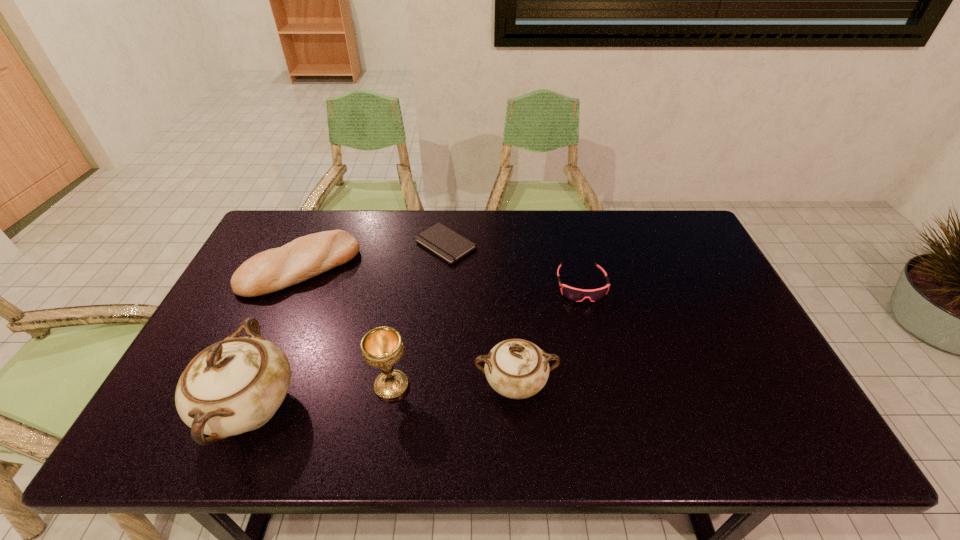
The width and height of the screenshot is (960, 540). I want to click on free space for a new chinaware on the right, so click(x=757, y=362).